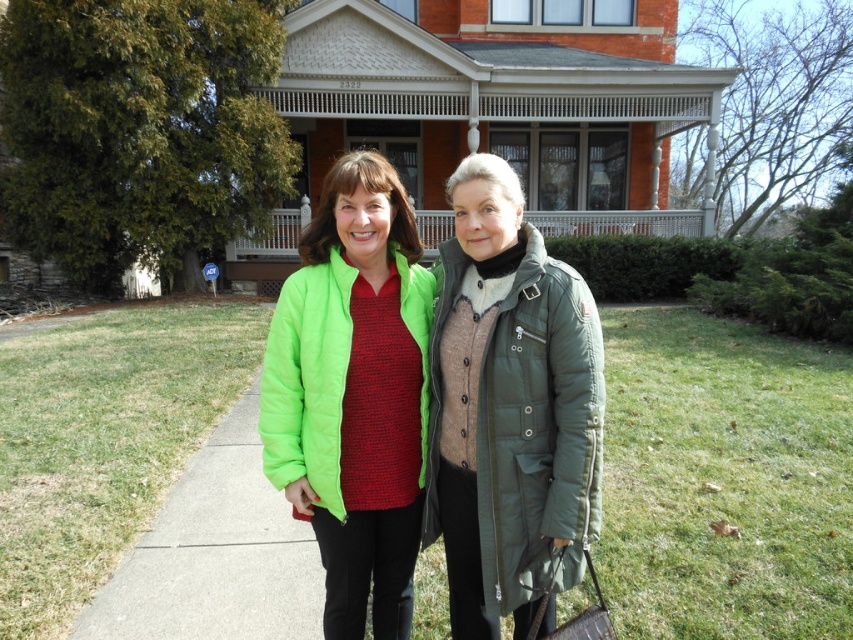
From the picture: Can you confirm if green quilted jacket at center is positioned below matte green puffer jacket at center?

No, green quilted jacket at center is not below matte green puffer jacket at center.

Is green quilted jacket at center bigger than matte green puffer jacket at center?

Yes, green quilted jacket at center is bigger than matte green puffer jacket at center.

Which is behind, point (459, 282) or point (329, 616)?

Positioned behind is point (329, 616).

I want to click on green quilted jacket at center, so click(509, 410).

Is point (351, 202) less distant than point (258, 636)?

Yes, point (351, 202) is in front of point (258, 636).

Does matte green puffer jacket at center have a greater height compared to green matte pavement at lower left?

Correct, matte green puffer jacket at center is much taller as green matte pavement at lower left.

Find the location of a particular element. Image resolution: width=853 pixels, height=640 pixels. matte green puffer jacket at center is located at coordinates (352, 394).

What are the coordinates of `matte green puffer jacket at center` in the screenshot? It's located at (352, 394).

Based on the photo, can you confirm if green quilted jacket at center is taller than green matte pavement at lower left?

Indeed, green quilted jacket at center has a greater height compared to green matte pavement at lower left.

In the scene shown: Which is more to the left, green quilted jacket at center or green matte pavement at lower left?

Result: green matte pavement at lower left

At what (x,y) coordinates should I click in order to perform the action: click on green quilted jacket at center. Please return your answer as a coordinate pair (x, y). Image resolution: width=853 pixels, height=640 pixels. Looking at the image, I should click on (509, 410).